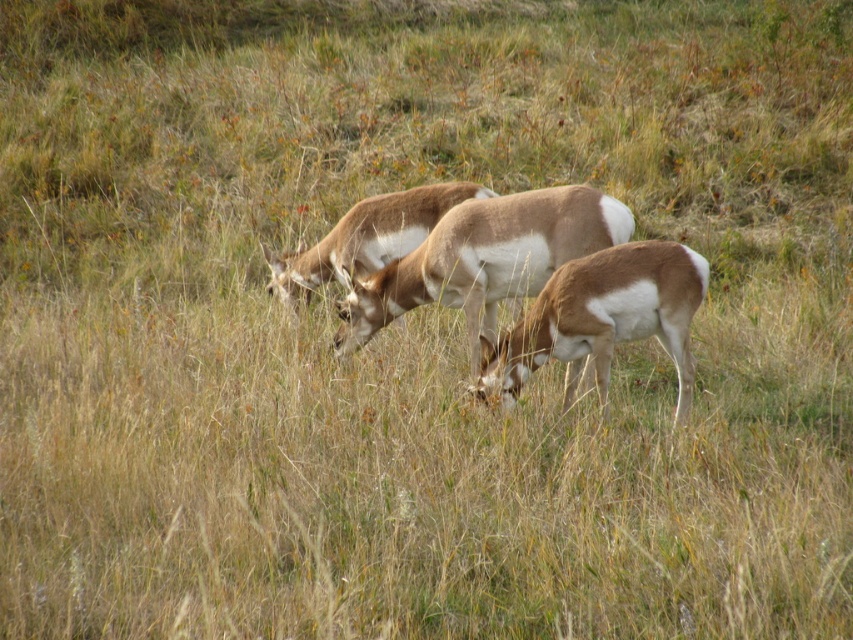
Question: Considering the real-world distances, which object is farthest from the brown velvet antelope at center?

Choices:
 (A) brown speckled antelope at center
 (B) brown fur antelope at center

Answer: (B)

Question: Observing the image, what is the correct spatial positioning of brown velvet antelope at center in reference to brown fur antelope at center?

Choices:
 (A) above
 (B) below

Answer: (B)

Question: Is brown speckled antelope at center thinner than brown velvet antelope at center?

Choices:
 (A) yes
 (B) no

Answer: (B)

Question: Which point is farther to the camera?

Choices:
 (A) brown fur antelope at center
 (B) brown speckled antelope at center
 (C) brown velvet antelope at center

Answer: (A)

Question: Does brown speckled antelope at center have a lesser width compared to brown fur antelope at center?

Choices:
 (A) no
 (B) yes

Answer: (A)

Question: Which point is closer to the camera?

Choices:
 (A) (300, 246)
 (B) (434, 294)

Answer: (B)